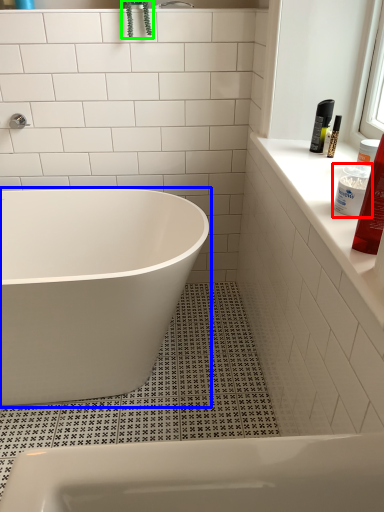
Question: Estimate the real-world distances between objects in this image. Which object is farther from cleaning product (highlighted by a red box), bathtub (highlighted by a blue box) or plant (highlighted by a green box)?

Choices:
 (A) bathtub
 (B) plant

Answer: (B)